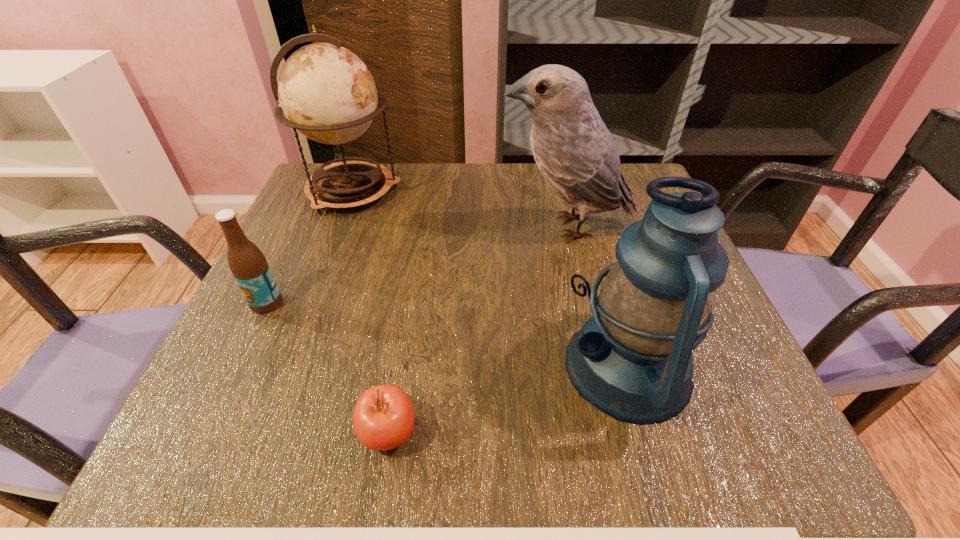
This screenshot has width=960, height=540. Find the location of `free point located on the face of the lantern`. free point located on the face of the lantern is located at coordinates (392, 367).

Identify the location of free space located 0.200m on the face of the lantern. The height and width of the screenshot is (540, 960). (442, 367).

Image resolution: width=960 pixels, height=540 pixels. Identify the location of free space located 0.330m on the face of the lantern. (361, 367).

Where is `vacant space positioned 0.110m on the front of the second shortest object`? The height and width of the screenshot is (540, 960). vacant space positioned 0.110m on the front of the second shortest object is located at coordinates 237,366.

You are a GUI agent. You are given a task and a screenshot of the screen. Output one action in this format:
    pyautogui.click(x=<x>, y=<y>)
    Task: Click on the vacant point located on the left of the shortest object
    This screenshot has height=540, width=960.
    Given the screenshot: What is the action you would take?
    pyautogui.click(x=184, y=433)

The height and width of the screenshot is (540, 960). What are the coordinates of `globe at the far edge` in the screenshot? It's located at (327, 93).

The height and width of the screenshot is (540, 960). Find the location of `parrot that is at the far edge`. parrot that is at the far edge is located at coordinates (575, 152).

Find the location of a particular element. This screenshot has height=540, width=960. lantern located at the near edge is located at coordinates (632, 359).

Where is `apple that is positioned at the near edge`? The height and width of the screenshot is (540, 960). apple that is positioned at the near edge is located at coordinates (383, 418).

Identify the location of globe that is at the left edge. The width and height of the screenshot is (960, 540). (327, 93).